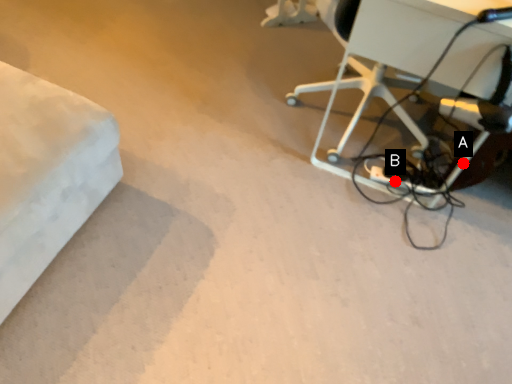
Question: Two points are circled on the image, labeled by A and B beside each circle. Which point is further to the camera?

Choices:
 (A) A is further
 (B) B is further

Answer: (B)